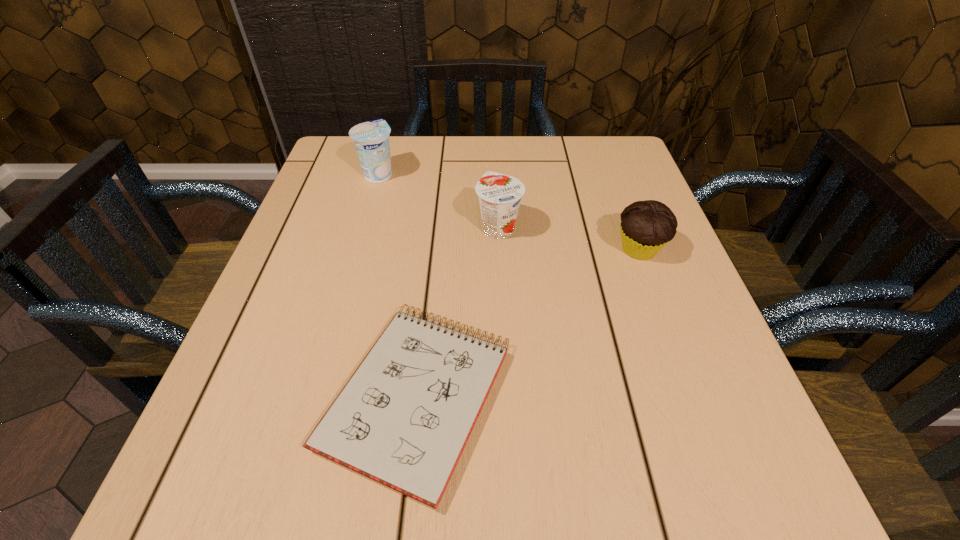
The image size is (960, 540). Find the location of `vacant region between the rightmost object and the nearest object`. vacant region between the rightmost object and the nearest object is located at coordinates (528, 323).

Identify the location of vacant area between the muffin and the right yogurt. (569, 239).

The height and width of the screenshot is (540, 960). What are the coordinates of `object identified as the closest to the nearest object` in the screenshot? It's located at (499, 195).

The width and height of the screenshot is (960, 540). Identify the location of object that is the closest to the farther yogurt. tap(499, 195).

Where is `vacant point that satisfies the following two spatial constraints: 1. on the front side of the nearer yogurt; 2. on the right side of the rightmost object`? This screenshot has height=540, width=960. vacant point that satisfies the following two spatial constraints: 1. on the front side of the nearer yogurt; 2. on the right side of the rightmost object is located at coordinates 499,249.

Locate an element on the screen. This screenshot has width=960, height=540. vacant position in the image that satisfies the following two spatial constraints: 1. on the front side of the left yogurt; 2. on the right side of the nearest object is located at coordinates (316, 396).

You are a GUI agent. You are given a task and a screenshot of the screen. Output one action in this format:
    pyautogui.click(x=<x>, y=<y>)
    Task: Click on the vacant space that satisfies the following two spatial constraints: 1. on the front side of the farthest object; 2. on the right side of the right yogurt
    The image size is (960, 540).
    Given the screenshot: What is the action you would take?
    pyautogui.click(x=364, y=228)